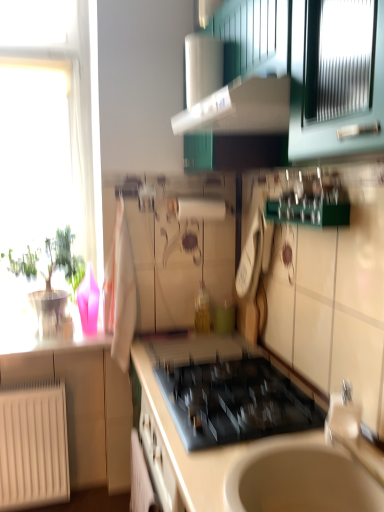
Question: Considering the relative sizes of silver metallic faucet at lower right and white matte radiator at lower left in the image provided, is silver metallic faucet at lower right shorter than white matte radiator at lower left?

Choices:
 (A) no
 (B) yes

Answer: (B)

Question: Is silver metallic faucet at lower right to the right of white matte radiator at lower left from the viewer's perspective?

Choices:
 (A) yes
 (B) no

Answer: (A)

Question: Is silver metallic faucet at lower right far away from white matte radiator at lower left?

Choices:
 (A) yes
 (B) no

Answer: (A)

Question: From the image's perspective, would you say silver metallic faucet at lower right is shown under white matte radiator at lower left?

Choices:
 (A) yes
 (B) no

Answer: (B)

Question: Can you confirm if silver metallic faucet at lower right is taller than white matte radiator at lower left?

Choices:
 (A) no
 (B) yes

Answer: (A)

Question: Would you say green glossy plant at left is to the left or to the right of white glossy countertop at center in the picture?

Choices:
 (A) left
 (B) right

Answer: (A)

Question: Considering the positions of green glossy plant at left and white glossy countertop at center in the image, is green glossy plant at left bigger or smaller than white glossy countertop at center?

Choices:
 (A) small
 (B) big

Answer: (A)

Question: Is green glossy plant at left inside or outside of white glossy countertop at center?

Choices:
 (A) outside
 (B) inside

Answer: (A)

Question: From a real-world perspective, is green glossy plant at left above or below white glossy countertop at center?

Choices:
 (A) above
 (B) below

Answer: (A)

Question: Looking at their shapes, would you say white glossy countertop at center is wider or thinner than silver metallic faucet at lower right?

Choices:
 (A) thin
 (B) wide

Answer: (B)

Question: Is white glossy countertop at center in front of or behind silver metallic faucet at lower right in the image?

Choices:
 (A) front
 (B) behind

Answer: (A)

Question: Is white glossy countertop at center to the left or to the right of silver metallic faucet at lower right in the image?

Choices:
 (A) right
 (B) left

Answer: (B)

Question: From the image's perspective, relative to silver metallic faucet at lower right, is white glossy countertop at center above or below?

Choices:
 (A) below
 (B) above

Answer: (A)

Question: Relative to black glass gas stove at center, is white glossy exhaust hood at upper center in front or behind?

Choices:
 (A) behind
 (B) front

Answer: (B)

Question: From a real-world perspective, is white glossy exhaust hood at upper center above or below black glass gas stove at center?

Choices:
 (A) below
 (B) above

Answer: (B)